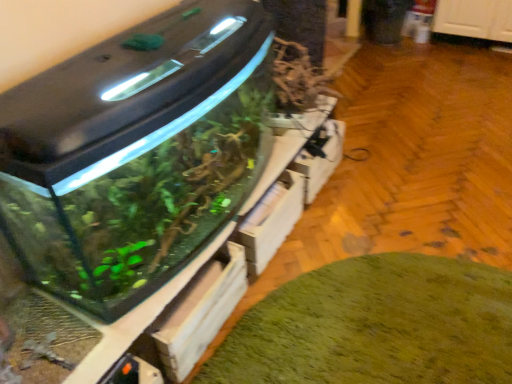
Where is `transparent glass aquarium at left`? The width and height of the screenshot is (512, 384). transparent glass aquarium at left is located at coordinates (136, 153).

What do you see at coordinates (136, 153) in the screenshot?
I see `transparent glass aquarium at left` at bounding box center [136, 153].

Where is `transparent glass aquarium at left`? This screenshot has height=384, width=512. transparent glass aquarium at left is located at coordinates (136, 153).